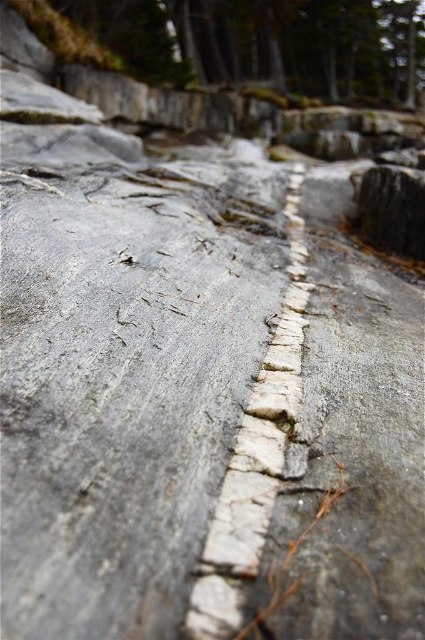
You are a geologist examining the rock formation. You need to locate the smooth gray rock at upper center. According to the coordinates provided, where exactly is it positioned?

The smooth gray rock at upper center is located at point coordinates of (268,42).

You are a geologist examining the rock formation. You need to determine which of the two features, the smooth gray rock at upper center or the white stone line at center, is higher in elevation. Based on the scene, which one is taller?

The smooth gray rock at upper center is taller than the white stone line at center according to the description.